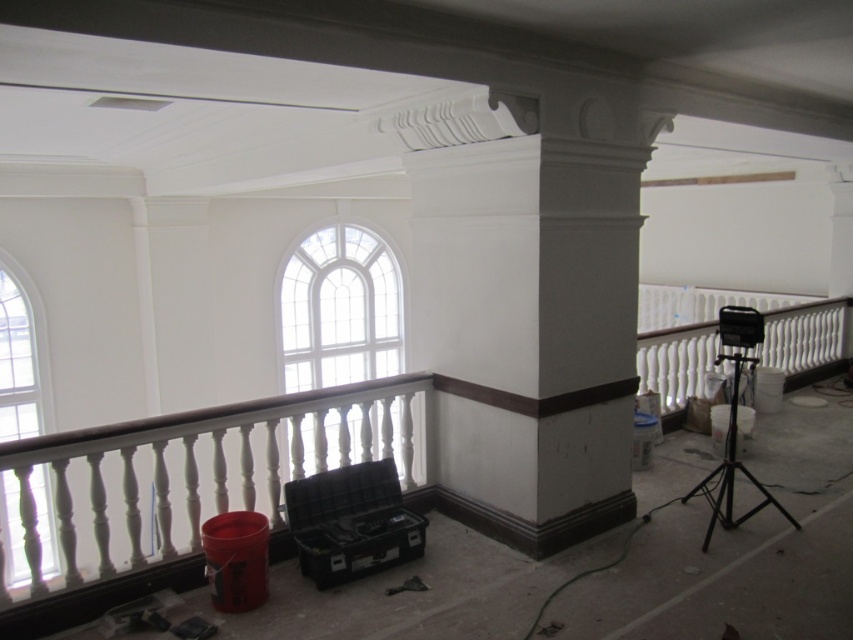
Question: Among these points, which one is farthest from the camera?

Choices:
 (A) (705, 484)
 (B) (36, 307)

Answer: (B)

Question: Is white glass window at center to the left of clear glass window at left from the viewer's perspective?

Choices:
 (A) yes
 (B) no

Answer: (B)

Question: Does white glass window at center appear over black metal tripod at right?

Choices:
 (A) no
 (B) yes

Answer: (B)

Question: Estimate the real-world distances between objects in this image. Which object is farther from the white glass window at center?

Choices:
 (A) clear glass window at left
 (B) black metal tripod at right

Answer: (A)

Question: Does clear glass window at left appear under black metal tripod at right?

Choices:
 (A) yes
 (B) no

Answer: (B)

Question: Which of the following is the farthest from the observer?

Choices:
 (A) (44, 404)
 (B) (729, 401)
 (C) (338, 291)

Answer: (C)